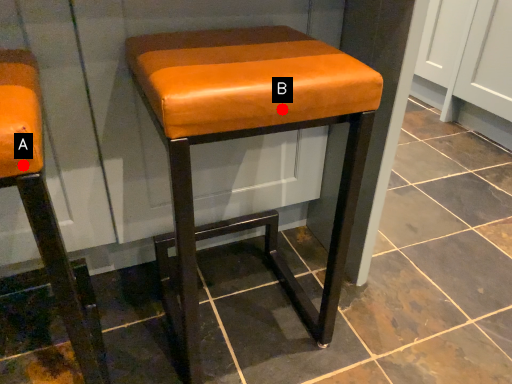
Question: Two points are circled on the image, labeled by A and B beside each circle. Which of the following is the closest to the observer?

Choices:
 (A) A is closer
 (B) B is closer

Answer: (A)